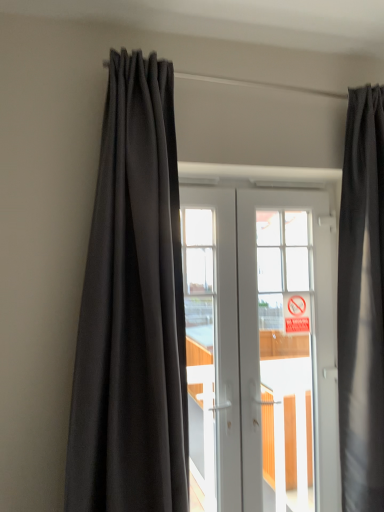
Question: Can you confirm if red plastic sign at center is shorter than dark gray fabric curtain at left, which is the 1th curtain from left to right?

Choices:
 (A) no
 (B) yes

Answer: (B)

Question: Does red plastic sign at center have a lesser width compared to dark gray fabric curtain at left, which is the 1th curtain from left to right?

Choices:
 (A) no
 (B) yes

Answer: (B)

Question: Considering the relative sizes of red plastic sign at center and dark gray fabric curtain at left, which is the 1th curtain from left to right, in the image provided, is red plastic sign at center taller than dark gray fabric curtain at left, which is the 1th curtain from left to right,?

Choices:
 (A) no
 (B) yes

Answer: (A)

Question: From a real-world perspective, is red plastic sign at center under dark gray fabric curtain at left, which is the 1th curtain from left to right?

Choices:
 (A) no
 (B) yes

Answer: (B)

Question: Is dark gray fabric curtain at left, which is counted as the second curtain, starting from the right, located within red plastic sign at center?

Choices:
 (A) no
 (B) yes

Answer: (A)

Question: Is white glossy door at center in front of or behind matte black curtain at upper right, which appears as the 1th curtain when viewed from the right, in the image?

Choices:
 (A) behind
 (B) front

Answer: (A)

Question: From a real-world perspective, relative to matte black curtain at upper right, which appears as the 1th curtain when viewed from the right, is white glossy door at center vertically above or below?

Choices:
 (A) below
 (B) above

Answer: (A)

Question: From the image's perspective, is white glossy door at center positioned above or below matte black curtain at upper right, acting as the 2th curtain starting from the left?

Choices:
 (A) above
 (B) below

Answer: (B)

Question: In terms of height, does white glossy door at center look taller or shorter compared to matte black curtain at upper right, which appears as the 1th curtain when viewed from the right?

Choices:
 (A) tall
 (B) short

Answer: (B)

Question: Considering the positions of dark gray fabric curtain at left, which is counted as the second curtain, starting from the right, and white glossy door at center in the image, is dark gray fabric curtain at left, which is counted as the second curtain, starting from the right, bigger or smaller than white glossy door at center?

Choices:
 (A) small
 (B) big

Answer: (B)

Question: Is point (142, 507) positioned closer to the camera than point (251, 204)?

Choices:
 (A) farther
 (B) closer

Answer: (B)

Question: Considering the positions of dark gray fabric curtain at left, which is the 1th curtain from left to right, and white glossy door at center in the image, is dark gray fabric curtain at left, which is the 1th curtain from left to right, taller or shorter than white glossy door at center?

Choices:
 (A) tall
 (B) short

Answer: (A)

Question: Is dark gray fabric curtain at left, which is the 1th curtain from left to right, spatially inside white glossy door at center, or outside of it?

Choices:
 (A) inside
 (B) outside

Answer: (B)

Question: Is red plastic sign at center inside or outside of dark gray fabric curtain at left, which is counted as the second curtain, starting from the right?

Choices:
 (A) inside
 (B) outside

Answer: (B)

Question: From the image's perspective, is red plastic sign at center above or below dark gray fabric curtain at left, which is counted as the second curtain, starting from the right?

Choices:
 (A) below
 (B) above

Answer: (A)